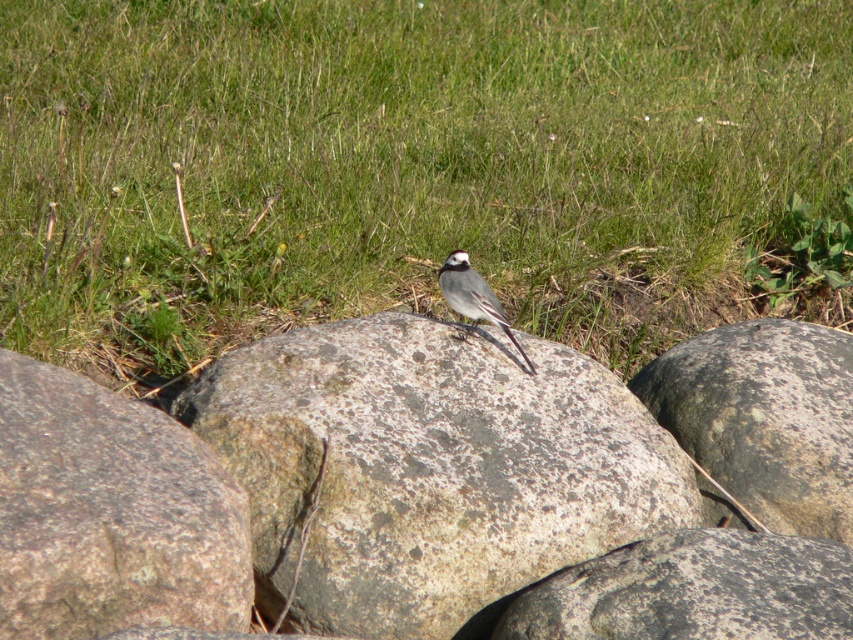
Question: Based on their relative distances, which object is nearer to the speckled granite boulder at center?

Choices:
 (A) green grass at center
 (B) white matte bird at center
 (C) speckled stone at center

Answer: (B)

Question: In this image, where is speckled stone boulder at center located relative to speckled granite boulder at center?

Choices:
 (A) above
 (B) below

Answer: (B)

Question: Which of the following is the closest to the observer?

Choices:
 (A) (463, 268)
 (B) (68, 429)
 (C) (840, 401)

Answer: (B)

Question: Can you confirm if speckled granite boulder at center is bigger than white matte bird at center?

Choices:
 (A) yes
 (B) no

Answer: (A)

Question: Which object appears closest to the camera in this image?

Choices:
 (A) green grass at center
 (B) speckled stone at center
 (C) white matte bird at center
 (D) speckled stone boulder at center

Answer: (D)

Question: Can you confirm if speckled stone at center is positioned to the left of speckled rock at center?

Choices:
 (A) no
 (B) yes

Answer: (A)